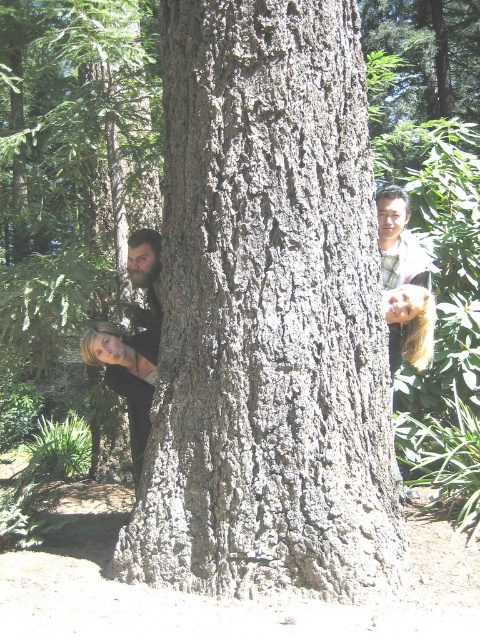
The width and height of the screenshot is (480, 640). Identify the location of gray rough bark at center. tap(267, 316).

Who is higher up, gray rough bark at center or bearded man at left?

gray rough bark at center

Which is behind, point (143, 538) or point (111, 333)?

The point (111, 333) is behind.

Locate an element on the screen. gray rough bark at center is located at coordinates (267, 316).

Which of these two, bearded man at left or smooth brown hair at center, stands shorter?

Standing shorter between the two is smooth brown hair at center.

Is bearded man at left taller than smooth brown hair at center?

Indeed, bearded man at left has a greater height compared to smooth brown hair at center.

Is point (147, 387) positioned in front of point (408, 266)?

Yes.

Locate an element on the screen. This screenshot has width=480, height=640. bearded man at left is located at coordinates (132, 342).

Does gray rough bark at center lie in front of smooth brown hair at center?

Yes.

Who is more forward, (334, 353) or (408, 284)?

Point (334, 353) is more forward.

Where is `gray rough bark at center`? The width and height of the screenshot is (480, 640). gray rough bark at center is located at coordinates coord(267,316).